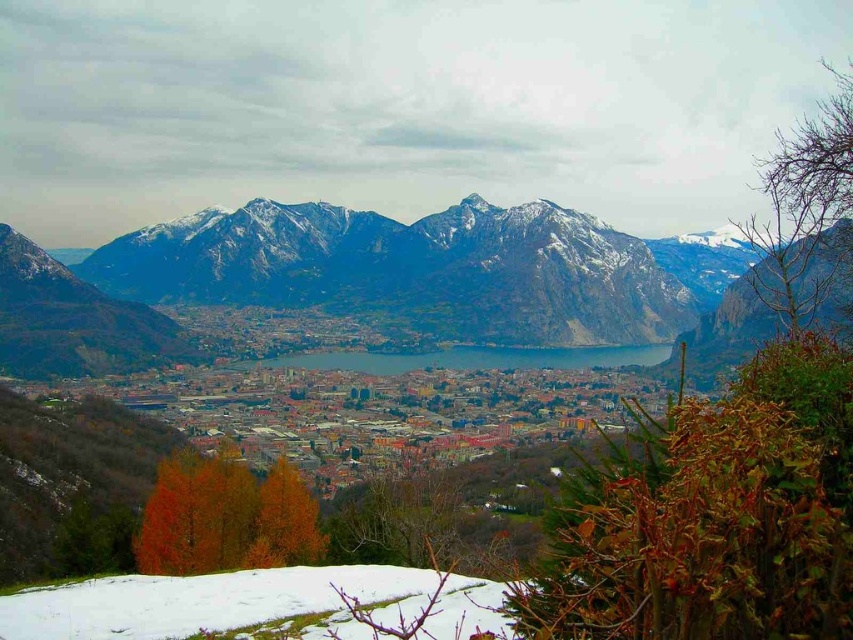
Can you confirm if white fluffy snow at lower left is positioned to the left of blue glass lake at center?

Indeed, white fluffy snow at lower left is positioned on the left side of blue glass lake at center.

Is white fluffy snow at lower left taller than blue glass lake at center?

Indeed, white fluffy snow at lower left has a greater height compared to blue glass lake at center.

The height and width of the screenshot is (640, 853). In order to click on white fluffy snow at lower left in this screenshot , I will do `click(218, 604)`.

Is snowy rock mountain range at upper center above white fluffy snow at lower left?

Yes.

Can you confirm if snowy rock mountain range at upper center is bigger than white fluffy snow at lower left?

Yes, snowy rock mountain range at upper center is bigger than white fluffy snow at lower left.

Does point (257, 234) come closer to viewer compared to point (331, 586)?

No, (257, 234) is further to viewer.

Image resolution: width=853 pixels, height=640 pixels. Identify the location of snowy rock mountain range at upper center. (415, 272).

Does snowy rock mountain range at upper center have a smaller size compared to blue glass lake at center?

No.

Which is behind, point (222, 224) or point (570, 364)?

Point (222, 224)

The width and height of the screenshot is (853, 640). What are the coordinates of `snowy rock mountain range at upper center` in the screenshot? It's located at (415, 272).